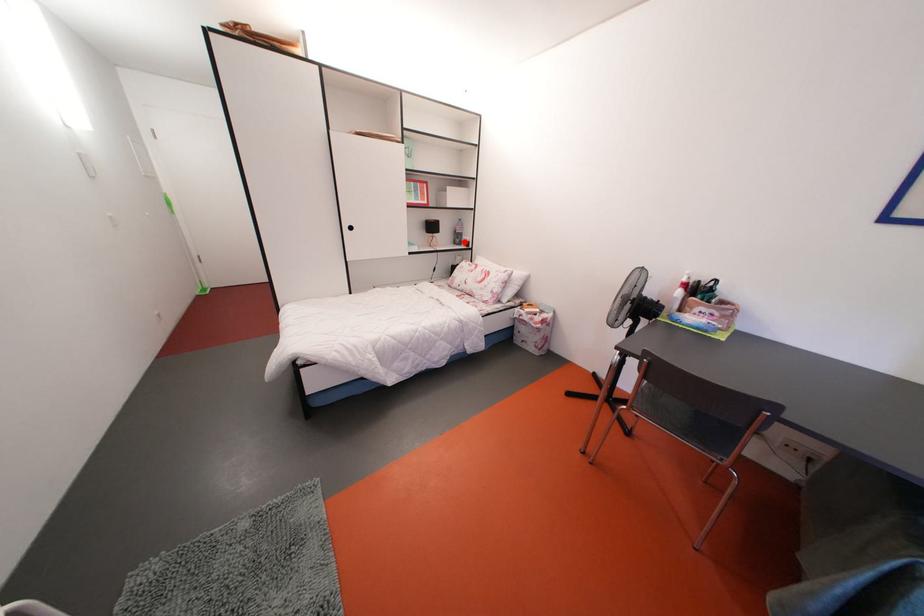
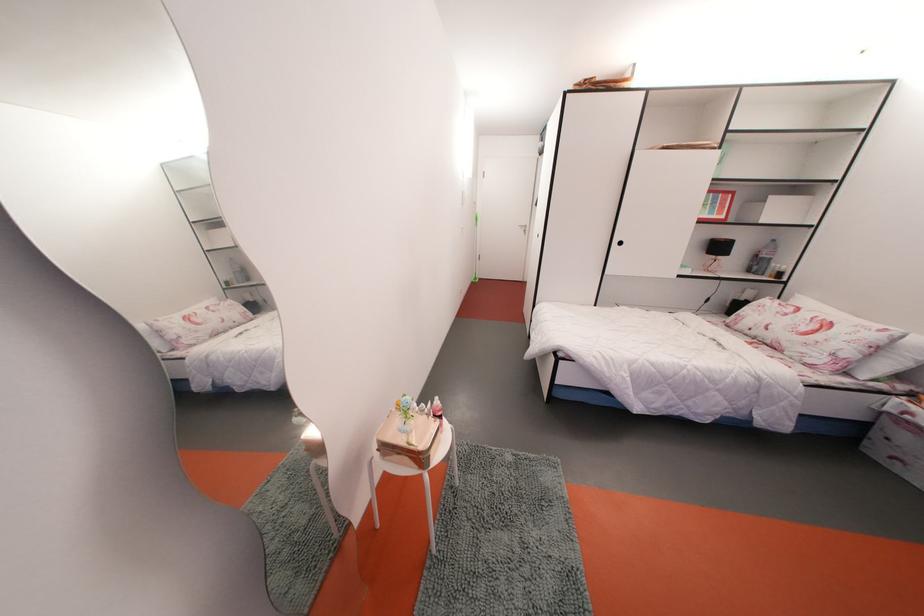
Find the pixel in the second image that matches the highlighted location in the first image.

(764, 268)